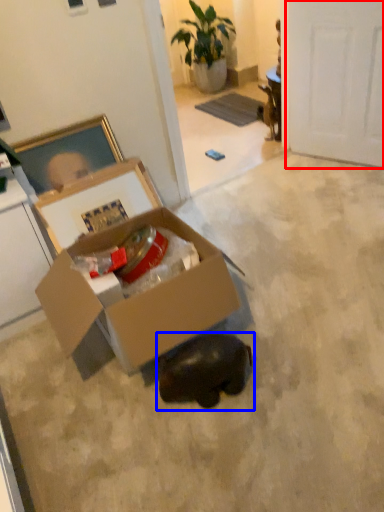
Question: Which object is closer to the camera taking this photo, door (highlighted by a red box) or animal (highlighted by a blue box)?

Choices:
 (A) door
 (B) animal

Answer: (B)